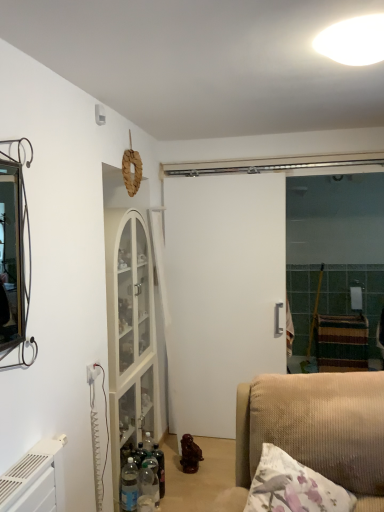
In order to click on white matte door at center in this screenshot , I will do `click(222, 293)`.

The image size is (384, 512). What do you see at coordinates (353, 40) in the screenshot? I see `white glossy light fixture at upper center` at bounding box center [353, 40].

This screenshot has width=384, height=512. I want to click on translucent glass bottle at center, positioned as the third bottle in front-to-back order, so click(x=160, y=468).

Locate an element on the screen. The width and height of the screenshot is (384, 512). white matte door at center is located at coordinates (222, 293).

Identify the location of pillow in front of the translucent plastic bottle at lower center, which is the 3th bottle from back to front. Image resolution: width=384 pixels, height=512 pixels. (293, 487).

Relative to fluffy white pillow at lower right, is translucent plastic bottle at lower center, the 1th bottle positioned from the front, in front or behind?

Clearly, translucent plastic bottle at lower center, the 1th bottle positioned from the front, is behind fluffy white pillow at lower right.

Considering the relative sizes of translucent plastic bottle at lower center, the 1th bottle positioned from the front, and fluffy white pillow at lower right in the image provided, is translucent plastic bottle at lower center, the 1th bottle positioned from the front, shorter than fluffy white pillow at lower right?

Indeed, translucent plastic bottle at lower center, the 1th bottle positioned from the front, has a lesser height compared to fluffy white pillow at lower right.

Can you confirm if translucent plastic bottle at lower center, the 1th bottle positioned from the front, is wider than fluffy white pillow at lower right?

No, translucent plastic bottle at lower center, the 1th bottle positioned from the front, is not wider than fluffy white pillow at lower right.

Which object is positioned more to the left, fluffy white pillow at lower right or white glossy light fixture at upper center?

fluffy white pillow at lower right.

Based on the photo, from the image's perspective, is fluffy white pillow at lower right above white glossy light fixture at upper center?

Actually, fluffy white pillow at lower right appears below white glossy light fixture at upper center in the image.

Is fluffy white pillow at lower right facing away from white glossy light fixture at upper center?

No, fluffy white pillow at lower right is not facing the opposite direction of white glossy light fixture at upper center.

Which is farther from the camera, [313,492] or [154,499]?

Point [154,499]

Looking at this image, is fluffy white pillow at lower right smaller than translucent plastic bottle at lower center, the 1th bottle positioned from the front?

Incorrect, fluffy white pillow at lower right is not smaller in size than translucent plastic bottle at lower center, the 1th bottle positioned from the front.

Can we say fluffy white pillow at lower right lies outside translucent plastic bottle at lower center, the 1th bottle positioned from the front?

Yes, fluffy white pillow at lower right is outside of translucent plastic bottle at lower center, the 1th bottle positioned from the front.

At what (x,y) coordinates should I click in order to perform the action: click on the 1st bottle in front of the white matte door at center. Please return your answer as a coordinate pair (x, y). Image resolution: width=384 pixels, height=512 pixels. Looking at the image, I should click on (160, 468).

How many degrees apart are the facing directions of translucent glass bottle at center, marked as the first bottle in a back-to-front arrangement, and white matte door at center?

The angular difference between translucent glass bottle at center, marked as the first bottle in a back-to-front arrangement, and white matte door at center is 90 degrees.

Which point is more distant from viewer, (160, 461) or (264, 262)?

Positioned behind is point (264, 262).

Could you tell me if translucent glass bottle at center, positioned as the third bottle in front-to-back order, is turned towards white matte door at center?

No, translucent glass bottle at center, positioned as the third bottle in front-to-back order, does not turn towards white matte door at center.

From the picture: Which object is closer to the camera taking this photo, translucent plastic bottles at lower left, the second bottle from the front, or white matte door at center?

translucent plastic bottles at lower left, the second bottle from the front, is more forward.

Looking at this image, what's the angular difference between translucent plastic bottles at lower left, acting as the second bottle starting from the back, and white matte door at center's facing directions?

The angular difference between translucent plastic bottles at lower left, acting as the second bottle starting from the back, and white matte door at center is 90 degrees.

From the image's perspective, is translucent plastic bottles at lower left, the second bottle from the front, located above white matte door at center?

Incorrect, from the image's perspective, translucent plastic bottles at lower left, the second bottle from the front, is lower than white matte door at center.

Does point (124, 506) come behind point (185, 313)?

No, it is in front of (185, 313).

Is white glossy light fixture at upper center placed right next to white matte door at center?

No.

In the image, is white glossy light fixture at upper center on the left side or the right side of white matte door at center?

Clearly, white glossy light fixture at upper center is on the right of white matte door at center in the image.

Looking at this image, which is behind, white glossy light fixture at upper center or white matte door at center?

white matte door at center is further from the camera.

Consider the image. Is white glossy light fixture at upper center smaller than white matte door at center?

Indeed, white glossy light fixture at upper center has a smaller size compared to white matte door at center.

Is translucent glass bottle at center, positioned as the third bottle in front-to-back order, at the right side of translucent plastic bottles at lower left, the second bottle from the front?

Yes.

Does translucent glass bottle at center, marked as the first bottle in a back-to-front arrangement, have a lesser width compared to translucent plastic bottles at lower left, acting as the second bottle starting from the back?

→ Yes.

Between translucent glass bottle at center, positioned as the third bottle in front-to-back order, and translucent plastic bottles at lower left, the second bottle from the front, which one has less height?

translucent glass bottle at center, positioned as the third bottle in front-to-back order.

From a real-world perspective, is translucent glass bottle at center, positioned as the third bottle in front-to-back order, over translucent plastic bottles at lower left, the second bottle from the front?

Actually, translucent glass bottle at center, positioned as the third bottle in front-to-back order, is physically below translucent plastic bottles at lower left, the second bottle from the front, in the real world.

Identify the location of pillow above the translucent plastic bottle at lower center, the 1th bottle positioned from the front (from a real-world perspective). (293, 487).

The image size is (384, 512). Find the location of `light lying on the right of fluffy white pillow at lower right`. light lying on the right of fluffy white pillow at lower right is located at coordinates (353, 40).

Which object lies further to the anchor point fluffy white pillow at lower right, translucent plastic bottle at lower center, the 1th bottle positioned from the front, or translucent glass bottle at center, positioned as the third bottle in front-to-back order?

Based on the image, translucent glass bottle at center, positioned as the third bottle in front-to-back order, appears to be further to fluffy white pillow at lower right.

Based on their spatial positions, is translucent glass bottle at center, positioned as the third bottle in front-to-back order, or fluffy white pillow at lower right further from white glossy light fixture at upper center?

translucent glass bottle at center, positioned as the third bottle in front-to-back order, lies further to white glossy light fixture at upper center than the other object.

Which object lies nearer to the anchor point translucent glass bottle at center, marked as the first bottle in a back-to-front arrangement, translucent plastic bottle at lower center, which is the 3th bottle from back to front, or white glossy light fixture at upper center?

translucent plastic bottle at lower center, which is the 3th bottle from back to front, lies closer to translucent glass bottle at center, marked as the first bottle in a back-to-front arrangement, than the other object.

Which object lies further to the anchor point white matte door at center, translucent plastic bottles at lower left, acting as the second bottle starting from the back, or fluffy white pillow at lower right?

fluffy white pillow at lower right.

Looking at the image, which one is located closer to translucent plastic bottles at lower left, the second bottle from the front, translucent glass bottle at center, marked as the first bottle in a back-to-front arrangement, or translucent plastic bottle at lower center, which is the 3th bottle from back to front?

translucent plastic bottle at lower center, which is the 3th bottle from back to front, lies closer to translucent plastic bottles at lower left, the second bottle from the front, than the other object.

From the image, which object appears to be nearer to translucent plastic bottle at lower center, the 1th bottle positioned from the front, white glossy light fixture at upper center or translucent glass bottle at center, marked as the first bottle in a back-to-front arrangement?

translucent glass bottle at center, marked as the first bottle in a back-to-front arrangement, is positioned closer to the anchor translucent plastic bottle at lower center, the 1th bottle positioned from the front.

Looking at the image, which one is located closer to white glossy light fixture at upper center, translucent plastic bottle at lower center, the 1th bottle positioned from the front, or translucent plastic bottles at lower left, acting as the second bottle starting from the back?

The object closer to white glossy light fixture at upper center is translucent plastic bottle at lower center, the 1th bottle positioned from the front.

Which object lies further to the anchor point white matte door at center, fluffy white pillow at lower right or translucent plastic bottles at lower left, acting as the second bottle starting from the back?

fluffy white pillow at lower right lies further to white matte door at center than the other object.

Locate an element on the screen. light positioned between fluffy white pillow at lower right and white matte door at center from near to far is located at coordinates (353, 40).

In order to click on bottle between white glossy light fixture at upper center and translucent plastic bottles at lower left, the second bottle from the front, in the up-down direction in this screenshot , I will do `click(160, 468)`.

Where is `pillow between white glossy light fixture at upper center and translucent plastic bottle at lower center, the 1th bottle positioned from the front, in the vertical direction`? This screenshot has width=384, height=512. pillow between white glossy light fixture at upper center and translucent plastic bottle at lower center, the 1th bottle positioned from the front, in the vertical direction is located at coordinates (293, 487).

The image size is (384, 512). I want to click on bottle between fluffy white pillow at lower right and translucent plastic bottles at lower left, the second bottle from the front, from front to back, so click(x=150, y=479).